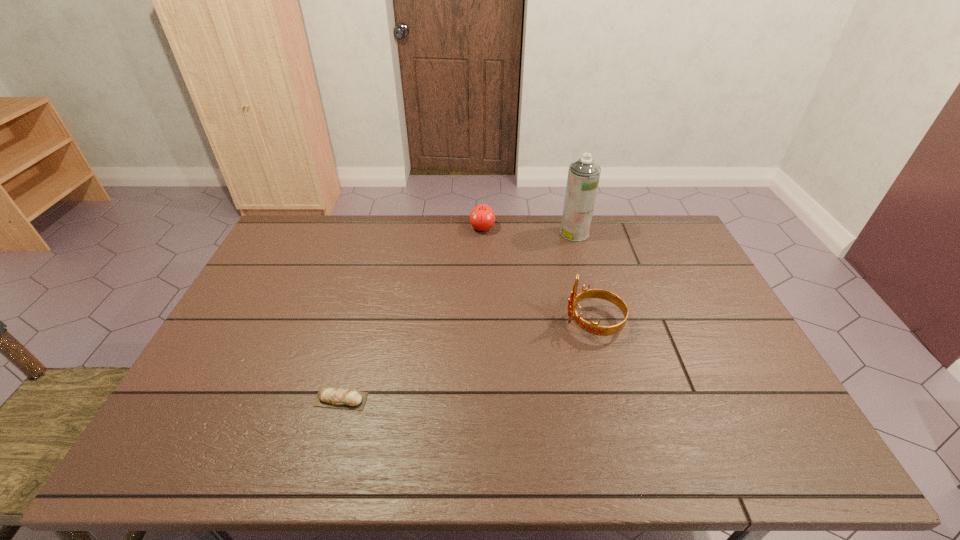
You are a GUI agent. You are given a task and a screenshot of the screen. Output one action in this format:
    pyautogui.click(x=<x>, y=<y>)
    Task: Click on the aerosol can
    
    Given the screenshot: What is the action you would take?
    pyautogui.click(x=583, y=176)

Locate an element on the screen. the third farthest object is located at coordinates (593, 328).

Locate an element on the screen. tiara is located at coordinates (593, 328).

Where is `apple`? Image resolution: width=960 pixels, height=540 pixels. apple is located at coordinates (482, 217).

At what (x,y) coordinates should I click in order to perform the action: click on the second object from left to right. Please return your answer as a coordinate pair (x, y). The image size is (960, 540). Looking at the image, I should click on (482, 217).

Locate an element on the screen. the shortest object is located at coordinates (327, 397).

In order to click on the leftmost object in this screenshot , I will do `click(327, 397)`.

This screenshot has height=540, width=960. Identify the location of blank area located on the left of the aerosol can. (509, 233).

Identify the location of vacant space located 0.200m on the front-facing side of the second nearest object. (495, 322).

Where is `free space located 0.330m on the front-facing side of the second nearest object`? The image size is (960, 540). free space located 0.330m on the front-facing side of the second nearest object is located at coordinates (451, 322).